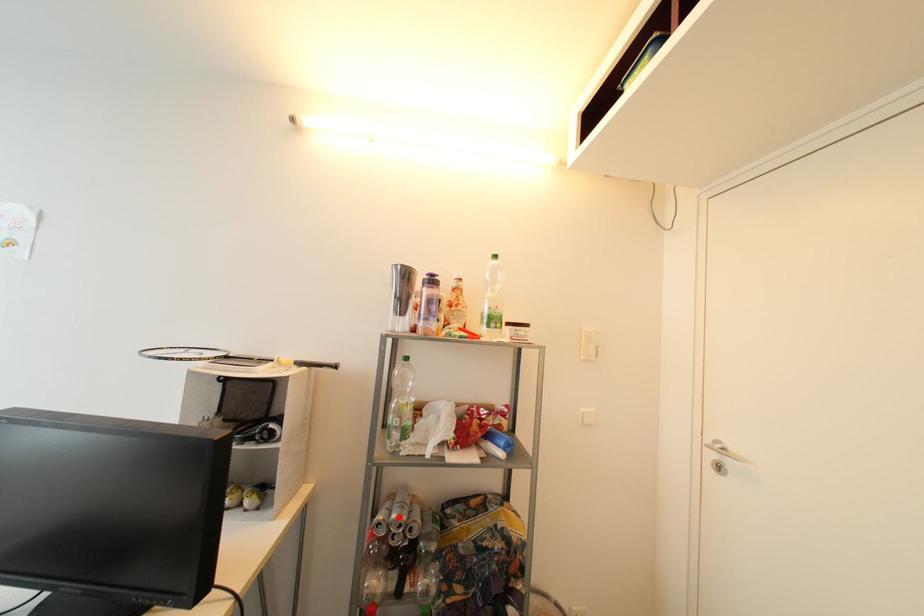
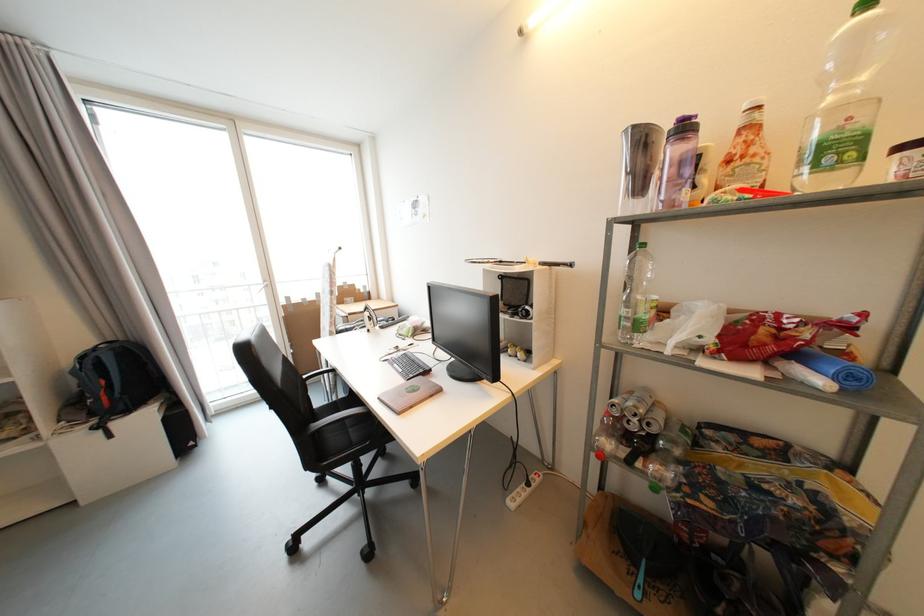
Question: I am providing you with two images of the same scene from different viewpoints. Image1 has a red point marked. In image2, the corresponding 3D location appears at what relative position? Reply with the corresponding letter.

Choices:
 (A) Closer
 (B) Farther

Answer: (A)